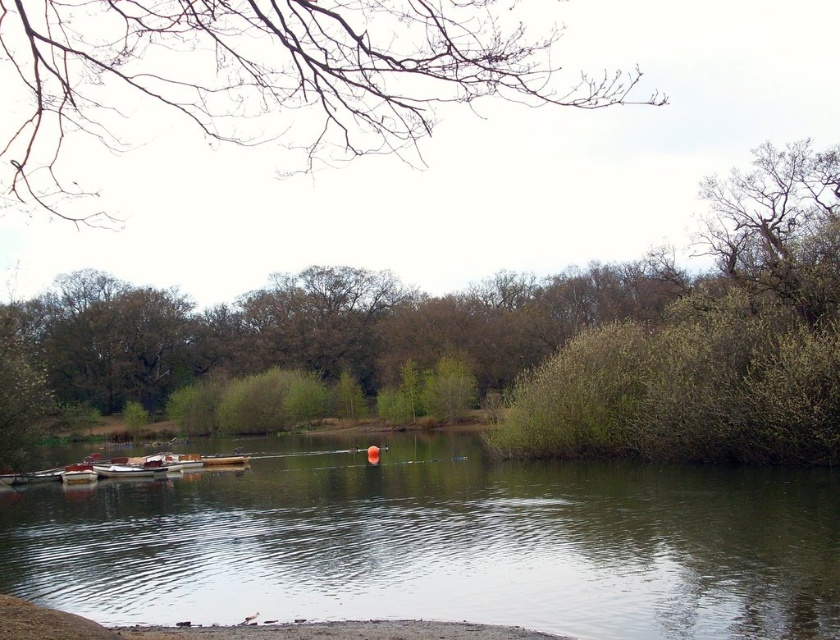
Can you confirm if green reflective water at center is positioned to the right of green leafy tree at center?

Indeed, green reflective water at center is positioned on the right side of green leafy tree at center.

Identify the location of green reflective water at center. (441, 541).

Where is `green reflective water at center`? The width and height of the screenshot is (840, 640). green reflective water at center is located at coordinates (441, 541).

Which of these two, green leafy tree at center or wooden boat at center, stands shorter?

wooden boat at center is shorter.

Is green leafy tree at center bigger than wooden boat at center?

Indeed, green leafy tree at center has a larger size compared to wooden boat at center.

Who is more distant from viewer, (x=686, y=310) or (x=200, y=456)?

Point (x=200, y=456)

Find the location of `green leafy tree at center`. green leafy tree at center is located at coordinates (433, 305).

Who is positioned more to the right, green reflective water at center or wooden boat at center?

green reflective water at center

Between point (308, 602) and point (242, 461), which one is positioned in front?

Point (308, 602) is more forward.

This screenshot has width=840, height=640. What do you see at coordinates (441, 541) in the screenshot?
I see `green reflective water at center` at bounding box center [441, 541].

The image size is (840, 640). Find the location of `green reflective water at center`. green reflective water at center is located at coordinates (441, 541).